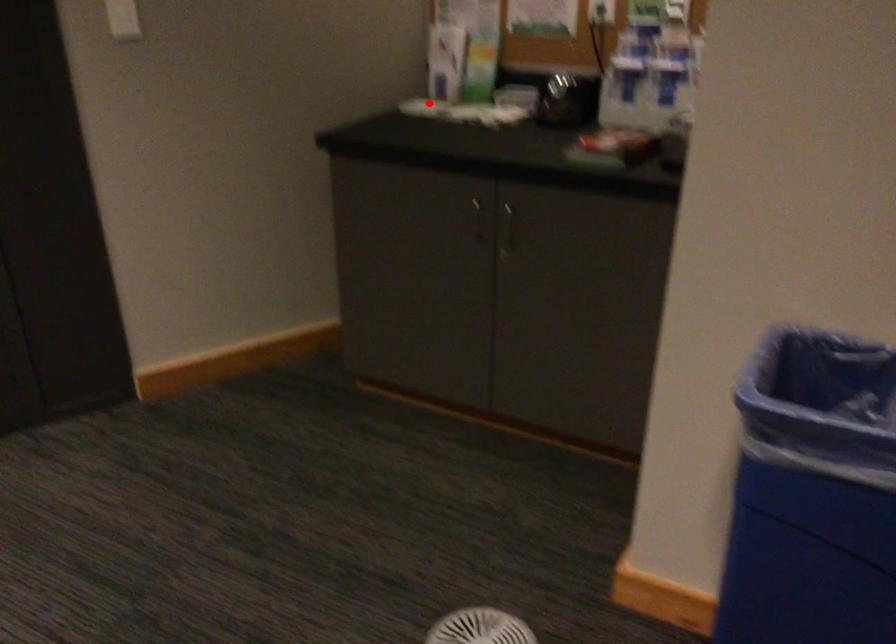
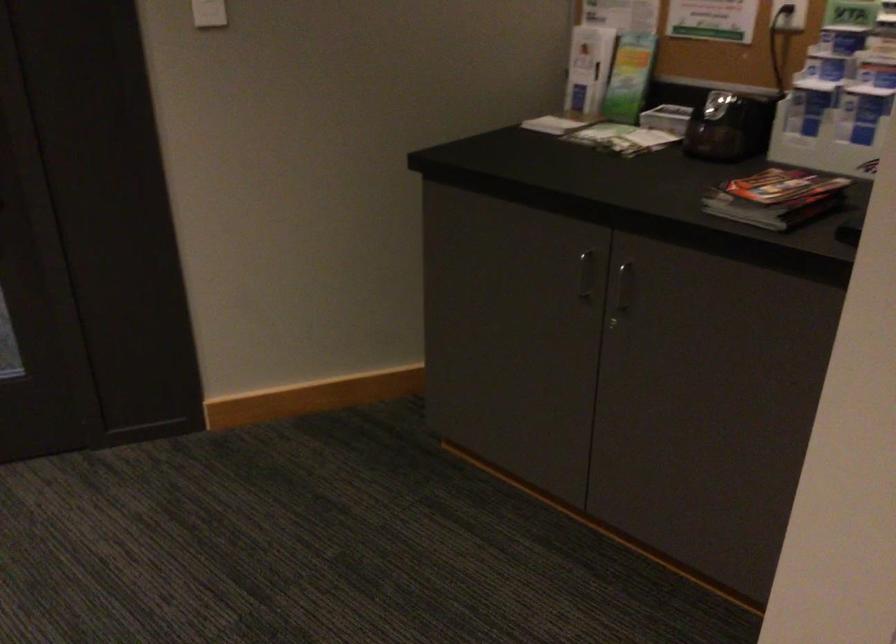
Question: I am providing you with two images of the same scene from different viewpoints. In image1, a red point is highlighted. Considering the same 3D point in image2, which of the following is correct?

Choices:
 (A) It is closer
 (B) It is farther

Answer: (A)